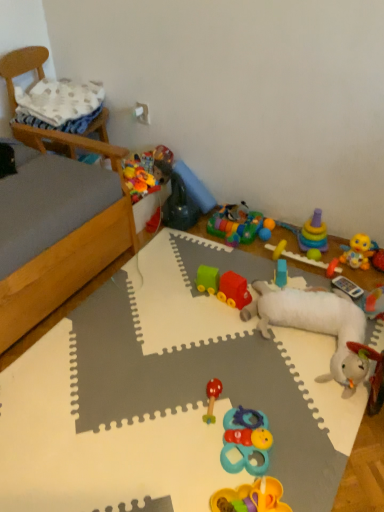
At what (x,y) coordinates should I click in order to perform the action: click on vacant area that lies between blue rubber teething ring at center, positioned as the first toy in bottom-to-top order, and white plush sheep at center, the third toy ordered from the bottom. Please return your answer as a coordinate pair (x, y). Looking at the image, I should click on (276, 390).